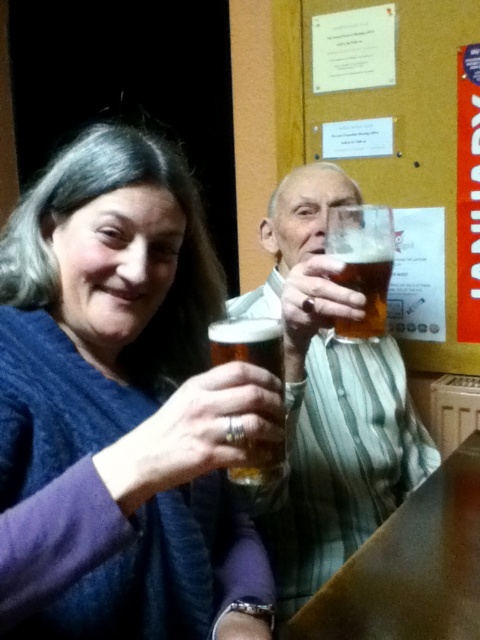
Who is positioned more to the left, matte blue sweater at upper left or translucent glass beer at center?

matte blue sweater at upper left is more to the left.

Is matte blue sweater at upper left taller than translucent glass beer at center?

Yes.

This screenshot has height=640, width=480. Describe the element at coordinates (122, 410) in the screenshot. I see `matte blue sweater at upper left` at that location.

Locate an element on the screen. The image size is (480, 640). matte blue sweater at upper left is located at coordinates (122, 410).

Is translucent glass at center bigger than translucent glass beer at center?

Yes.

Find the location of a particular element. translucent glass at center is located at coordinates (327, 400).

Measure the distance between matte blue sweater at upper left and translucent glass at center.

matte blue sweater at upper left is 10.31 inches away from translucent glass at center.

Who is more forward, (105,449) or (362,408)?

Point (105,449)

Who is more forward, (168, 634) or (287, 266)?

Point (168, 634) is more forward.

This screenshot has width=480, height=640. Identify the location of matte blue sweater at upper left. (122, 410).